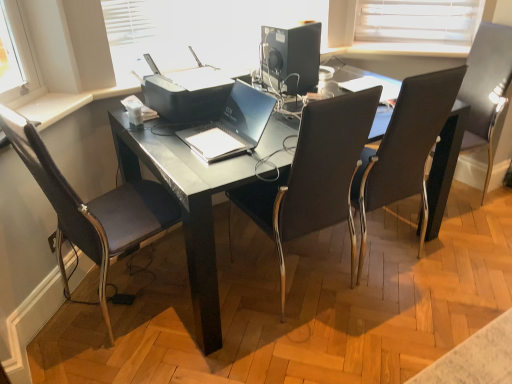
Find the location of a particular element. Image resolution: width=512 pixels, height=384 pixels. vacant area that lies between black glossy desk at center and dark brown leather chair at left, positioned as the 1th chair in left-to-right order is located at coordinates (138, 321).